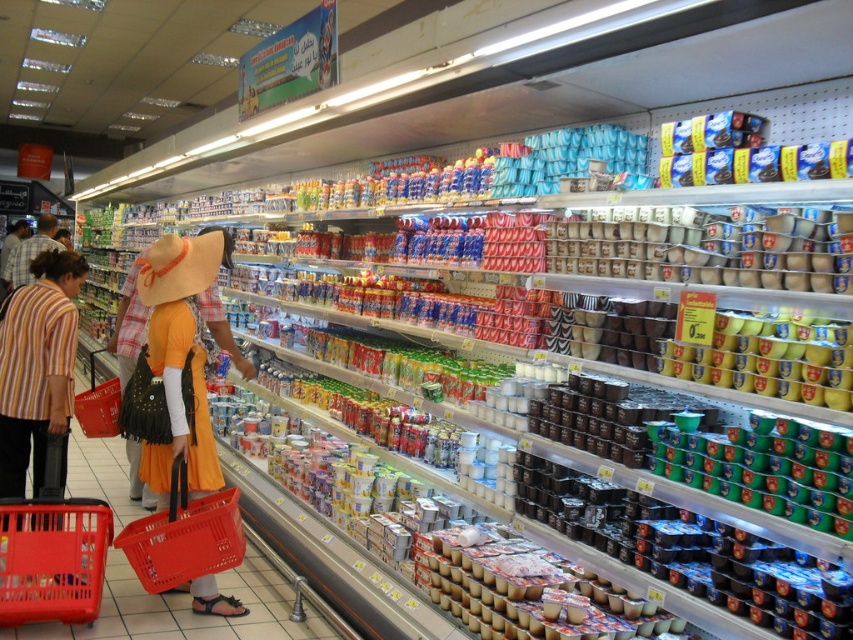
Who is more distant from viewer, (x=3, y=604) or (x=91, y=387)?

The point (x=91, y=387) is behind.

Is plastic shopping basket at lower left bigger than matte plastic basket at lower left?

No, plastic shopping basket at lower left is not bigger than matte plastic basket at lower left.

Where is `plastic shopping basket at lower left`? plastic shopping basket at lower left is located at coordinates (51, 560).

The height and width of the screenshot is (640, 853). What are the coordinates of `plastic shopping basket at lower left` in the screenshot? It's located at (51, 560).

Is point (715, 280) positioned before point (103, 420)?

Yes.

Is white matte yogurt cups at center taller than matte plastic basket at lower left?

Incorrect, white matte yogurt cups at center's height is not larger of matte plastic basket at lower left's.

Image resolution: width=853 pixels, height=640 pixels. Describe the element at coordinates (705, 252) in the screenshot. I see `white matte yogurt cups at center` at that location.

Identify the location of white matte yogurt cups at center. This screenshot has width=853, height=640. (705, 252).

Can you confirm if matte yellow dress at center is wider than matte plastic basket at lower left?

No.

Where is `matte yellow dress at center`? This screenshot has height=640, width=853. matte yellow dress at center is located at coordinates (183, 356).

Locate an element on the screen. The image size is (853, 640). matte yellow dress at center is located at coordinates (183, 356).